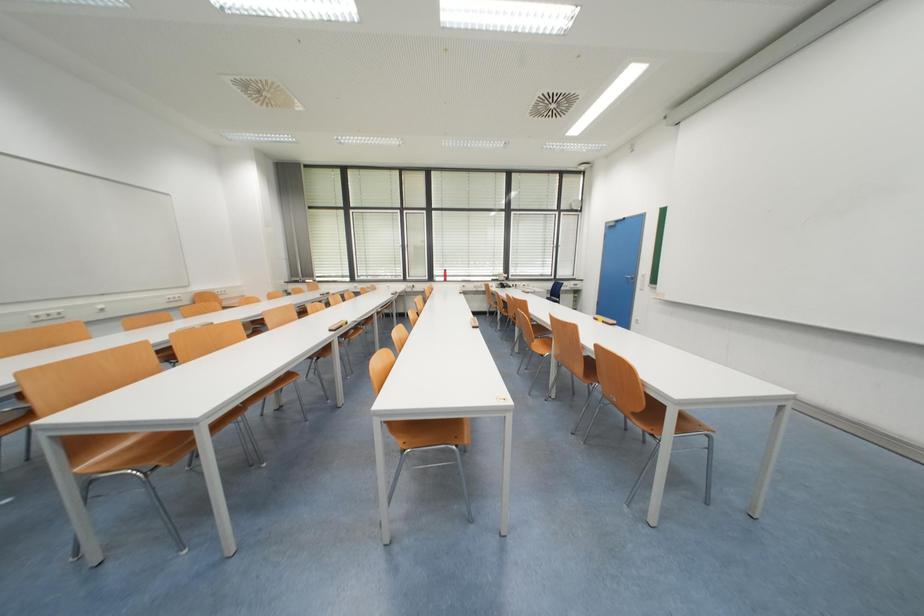
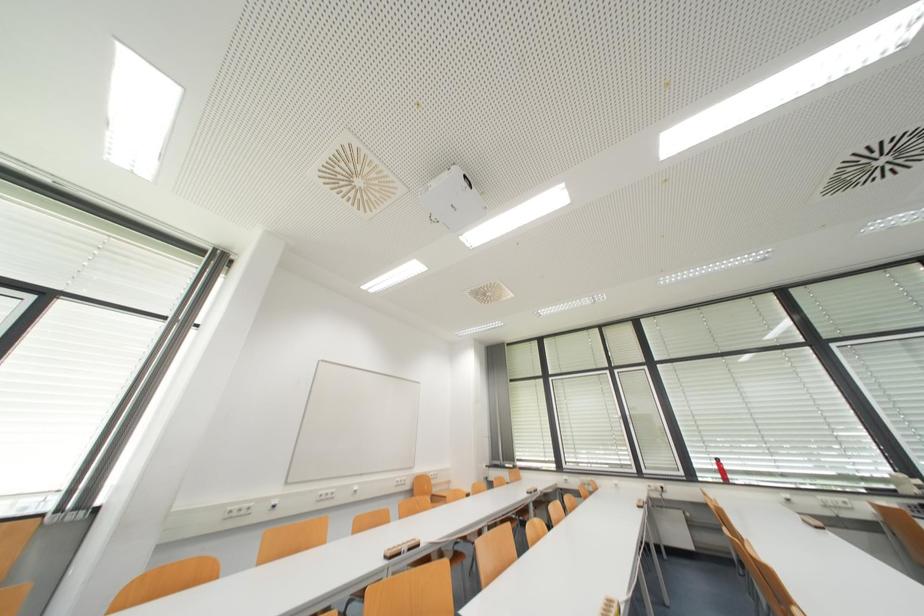
The images are taken continuously from a first-person perspective. In which direction is your viewpoint rotating?

The camera rotated toward left-up.